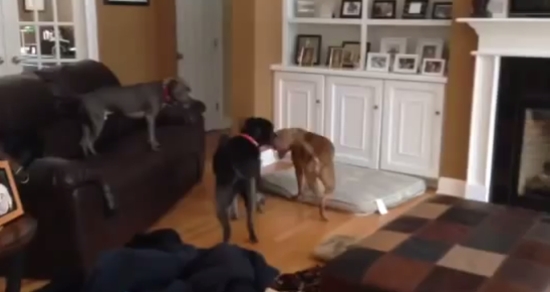
Find the location of a particular element. brown leather couch is located at coordinates (134, 168).